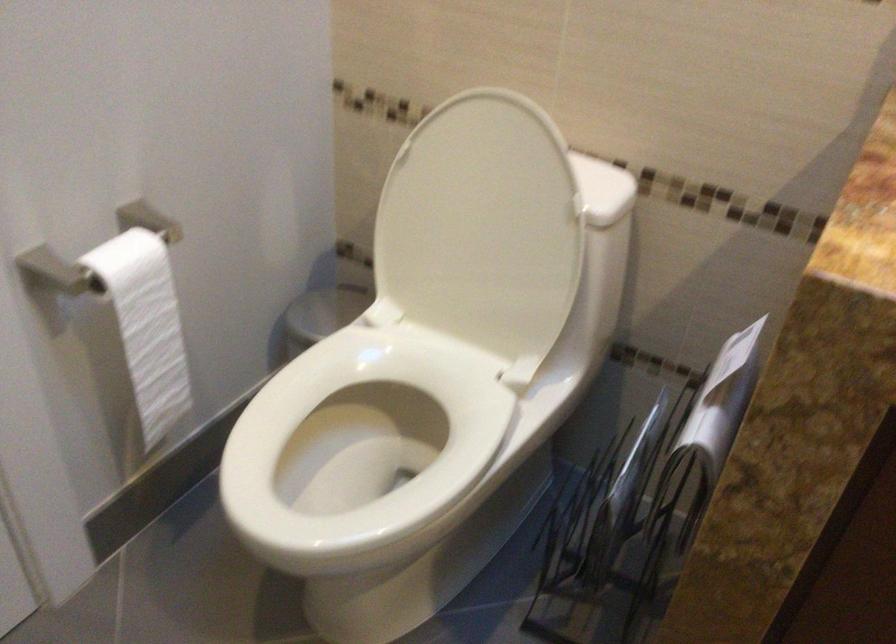
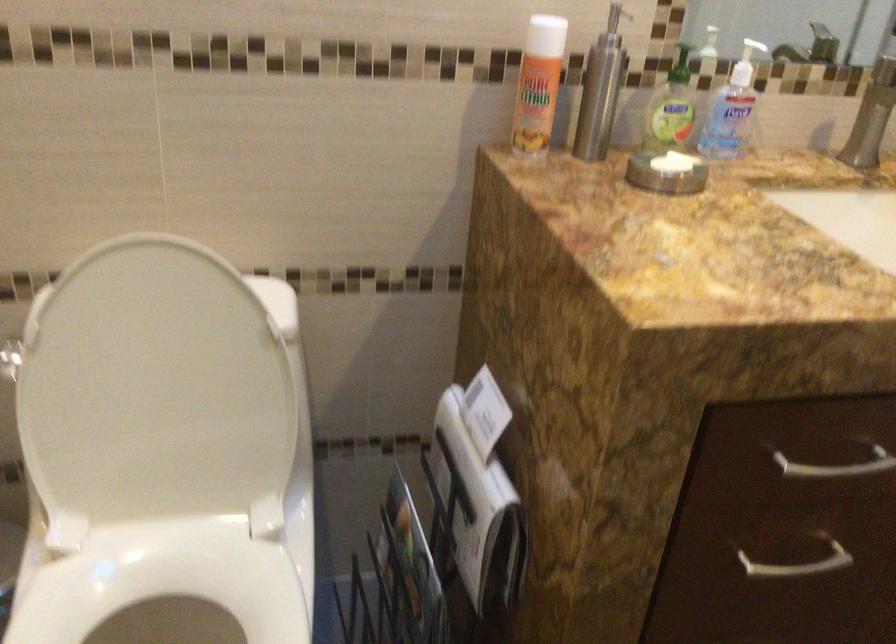
Question: How did the camera likely rotate?

Choices:
 (A) Left
 (B) Right
 (C) Up
 (D) Down

Answer: (B)